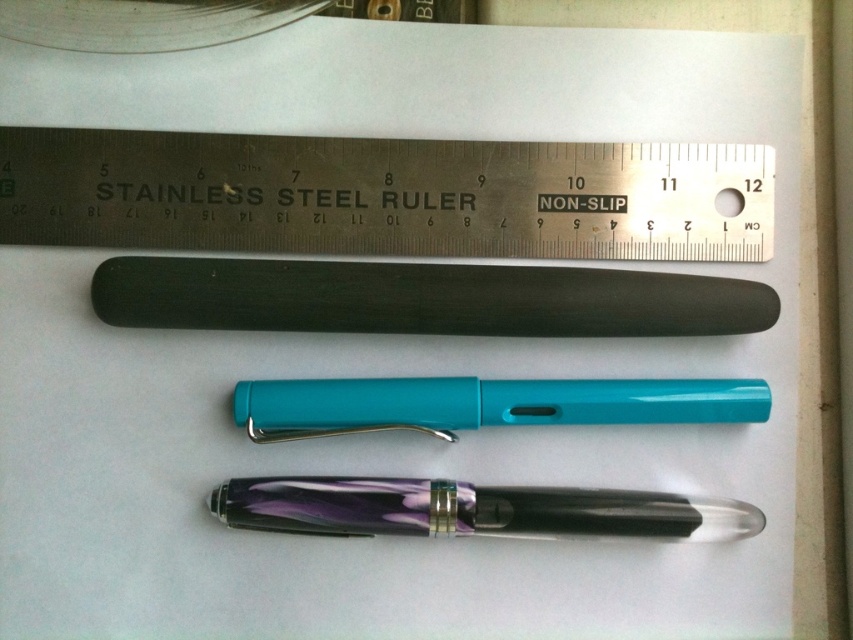
You are looking at the stationery items on the white surface. There are two points marked on the image, one at point (x=758, y=170) and another at point (x=607, y=314). Which point is closer to you?

Point (x=758, y=170) is further to the camera than point (x=607, y=314), so the point closer to you is point (x=607, y=314).

You are trying to determine the order of two points on the ruler. The first point is at coordinates point (x=390, y=291) and the second point is at point (x=274, y=529). According to the ruler, which point comes first when reading from left to right?

Point (x=390, y=291) comes first when reading from left to right on the ruler because it is positioned behind point (x=274, y=529).

You are organizing stationery items on a desk and need to place both the black rubberized pen at center and the translucent purple pen at center into a small pencil case. Which pen should you place first to ensure both fit properly?

The black rubberized pen at center is larger in size than the translucent purple pen at center, so you should place the larger black rubberized pen at center first to ensure both fit properly.